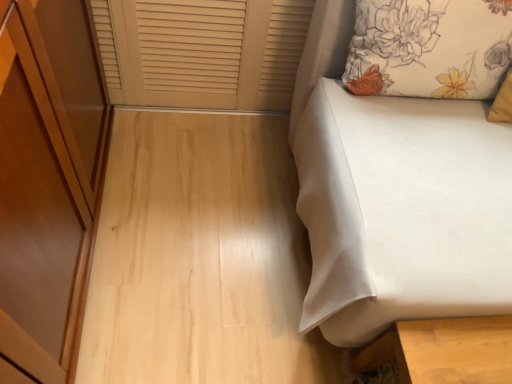
Question: From the image's perspective, is floral fabric pillow at upper right located above white fabric bed at right?

Choices:
 (A) yes
 (B) no

Answer: (A)

Question: Is floral fabric pillow at upper right turned away from white fabric bed at right?

Choices:
 (A) yes
 (B) no

Answer: (A)

Question: Is floral fabric pillow at upper right bigger than white fabric bed at right?

Choices:
 (A) yes
 (B) no

Answer: (B)

Question: Is floral fabric pillow at upper right far from white fabric bed at right?

Choices:
 (A) yes
 (B) no

Answer: (B)

Question: Is floral fabric pillow at upper right smaller than white fabric bed at right?

Choices:
 (A) yes
 (B) no

Answer: (A)

Question: Considering the positions of point (396, 89) and point (146, 16), is point (396, 89) closer or farther from the camera than point (146, 16)?

Choices:
 (A) closer
 (B) farther

Answer: (A)

Question: In terms of height, does floral fabric pillow at upper right look taller or shorter compared to beige wood window frame at upper left?

Choices:
 (A) short
 (B) tall

Answer: (A)

Question: In the image, is floral fabric pillow at upper right on the left side or the right side of beige wood window frame at upper left?

Choices:
 (A) left
 (B) right

Answer: (B)

Question: Based on their sizes in the image, would you say floral fabric pillow at upper right is bigger or smaller than beige wood window frame at upper left?

Choices:
 (A) big
 (B) small

Answer: (B)

Question: Considering the positions of point (274, 76) and point (392, 266), is point (274, 76) closer or farther from the camera than point (392, 266)?

Choices:
 (A) farther
 (B) closer

Answer: (A)

Question: Looking at their shapes, would you say beige wood window frame at upper left is wider or thinner than white fabric bed at right?

Choices:
 (A) thin
 (B) wide

Answer: (A)

Question: From the image's perspective, relative to white fabric bed at right, is beige wood window frame at upper left above or below?

Choices:
 (A) above
 (B) below

Answer: (A)

Question: From a real-world perspective, is beige wood window frame at upper left physically located above or below white fabric bed at right?

Choices:
 (A) above
 (B) below

Answer: (B)

Question: Choose the correct answer: Is white fabric bed at right inside beige wood window frame at upper left or outside it?

Choices:
 (A) inside
 (B) outside

Answer: (B)

Question: Considering the positions of point (361, 127) and point (231, 91), is point (361, 127) closer or farther from the camera than point (231, 91)?

Choices:
 (A) farther
 (B) closer

Answer: (B)